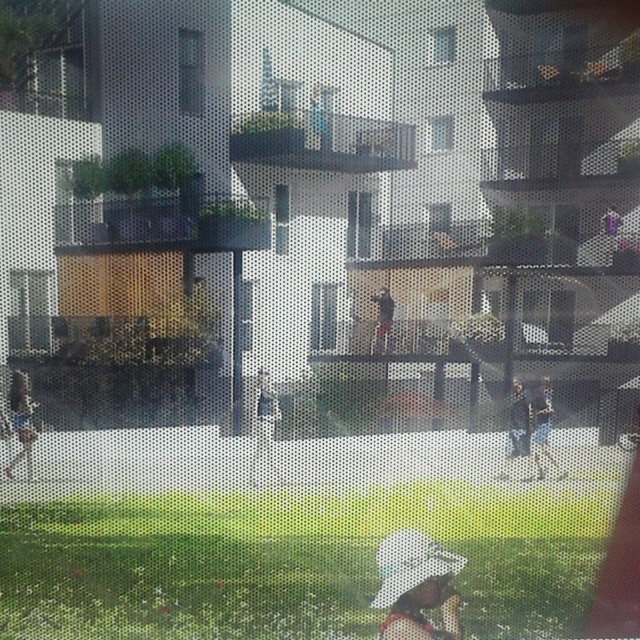
Question: Which object appears closest to the camera in this image?

Choices:
 (A) dark gray fabric jacket at center
 (B) light blue denim jeans at lower right
 (C) dark blue jeans at center

Answer: (C)

Question: Can you confirm if green grass at lower center is positioned above dark gray fabric jacket at center?

Choices:
 (A) yes
 (B) no

Answer: (B)

Question: Which object appears closest to the camera in this image?

Choices:
 (A) white cotton shirt at lower left
 (B) green grass at lower center
 (C) light blue denim jeans at lower right

Answer: (A)

Question: Which point is farther to the camera?

Choices:
 (A) white cotton shirt at lower left
 (B) light blue denim jeans at lower right

Answer: (B)

Question: Can you confirm if white cotton shirt at lower left is bigger than dark gray fabric jacket at center?

Choices:
 (A) no
 (B) yes

Answer: (B)

Question: Does light blue denim jeans at lower right have a larger size compared to dark gray fabric jacket at center?

Choices:
 (A) no
 (B) yes

Answer: (B)